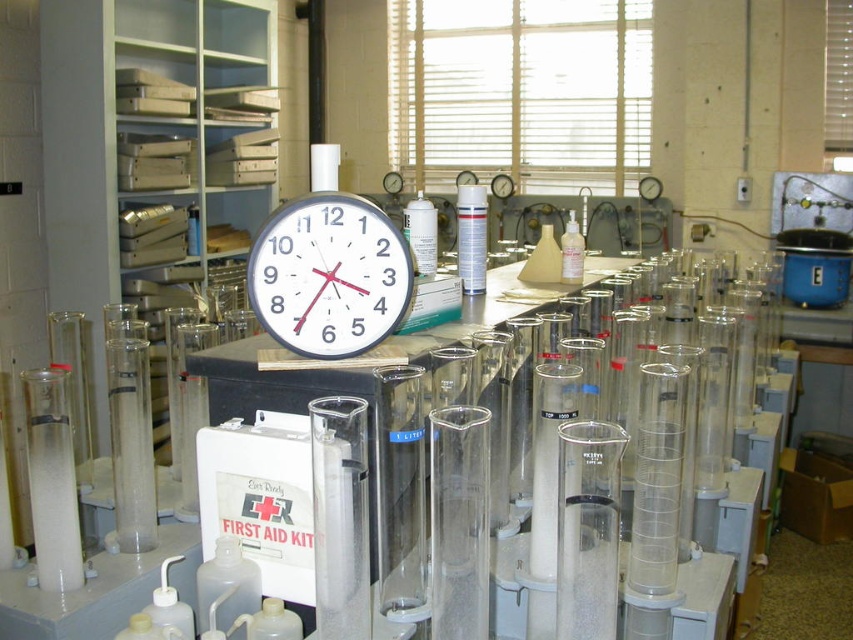
Question: Which object appears closest to the camera in this image?

Choices:
 (A) translucent plastic bottle at center
 (B) white plastic clock at center

Answer: (B)

Question: Which object appears farthest from the camera in this image?

Choices:
 (A) white plastic clock at center
 (B) translucent plastic bottle at center

Answer: (B)

Question: Is white plastic clock at center closer to camera compared to translucent plastic bottle at center?

Choices:
 (A) yes
 (B) no

Answer: (A)

Question: Can you confirm if white plastic clock at center is thinner than translucent plastic bottle at center?

Choices:
 (A) no
 (B) yes

Answer: (A)

Question: Which point appears closest to the camera in this image?

Choices:
 (A) (569, 218)
 (B) (363, 230)

Answer: (B)

Question: Is white plastic clock at center thinner than translucent plastic bottle at center?

Choices:
 (A) no
 (B) yes

Answer: (A)